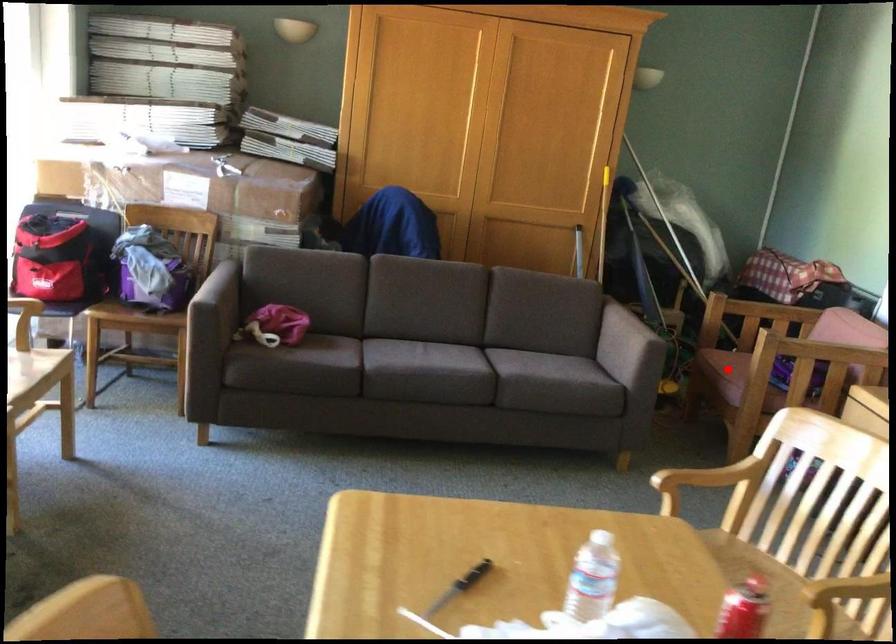
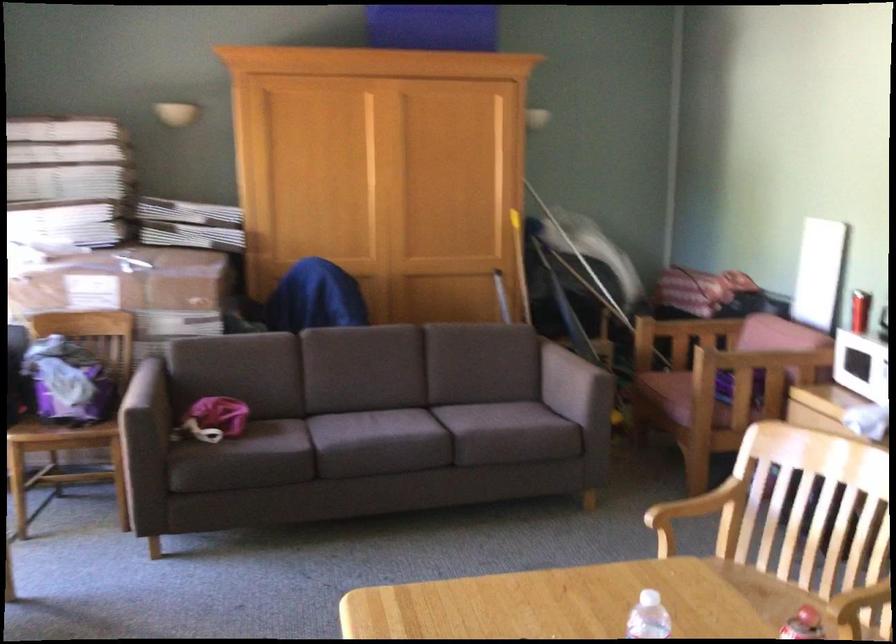
The point at the highlighted location is marked in the first image. Where is the corresponding point in the second image?

(669, 393)